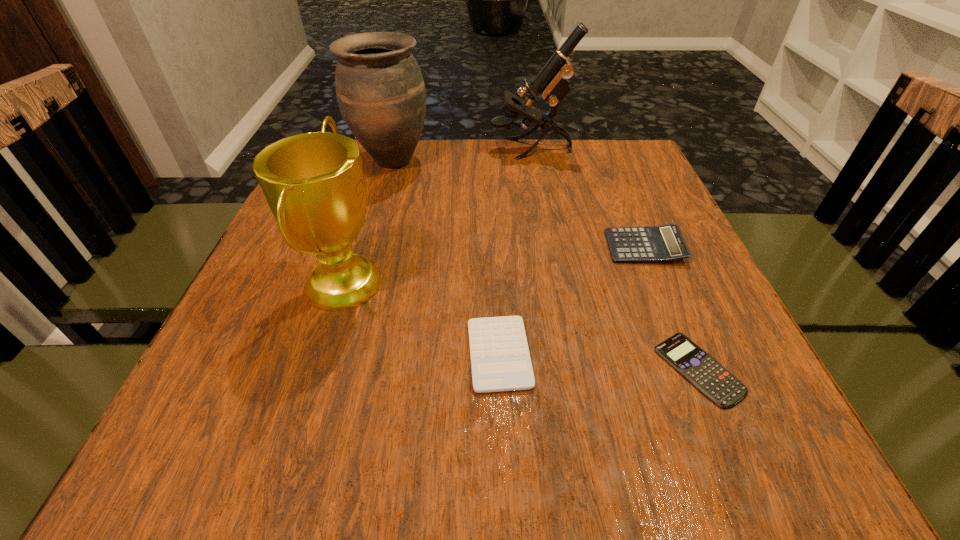
This screenshot has width=960, height=540. Identify the location of microscope. (552, 80).

This screenshot has height=540, width=960. Find the location of `urn`. urn is located at coordinates (381, 94).

Where is `award`? award is located at coordinates (314, 184).

Identify the location of the farthest calculator. (663, 243).

At what (x,y) coordinates should I click in order to perform the action: click on the tallest calculator. Please return your answer as a coordinate pair (x, y). The width and height of the screenshot is (960, 540). Looking at the image, I should click on (663, 243).

The width and height of the screenshot is (960, 540). Find the location of `the second shortest calculator`. the second shortest calculator is located at coordinates (500, 360).

Where is `the second shortest object`? The width and height of the screenshot is (960, 540). the second shortest object is located at coordinates (500, 360).

The width and height of the screenshot is (960, 540). I want to click on the shortest object, so (x=713, y=380).

The height and width of the screenshot is (540, 960). Find the location of `blank area located 0.330m through the eyepiece of the microscope`. blank area located 0.330m through the eyepiece of the microscope is located at coordinates (368, 149).

Find the location of a particular element. The width and height of the screenshot is (960, 540). free spot located 0.320m through the eyepiece of the microscope is located at coordinates pos(372,149).